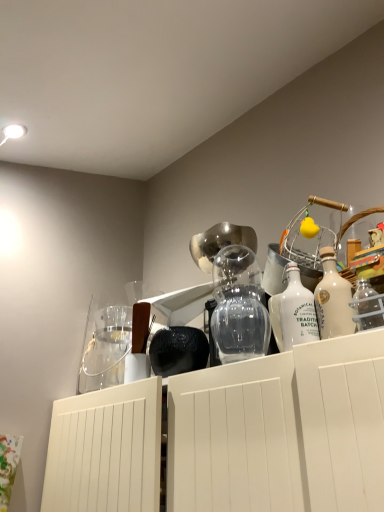
What is the approximate height of clear glass jar at upper left?

11.38 inches.

What do you see at coordinates (105, 347) in the screenshot?
I see `clear glass jar at upper left` at bounding box center [105, 347].

Image resolution: width=384 pixels, height=512 pixels. Describe the element at coordinates (293, 312) in the screenshot. I see `white glass bottle at center, arranged as the first bottle when viewed from the left` at that location.

This screenshot has height=512, width=384. Identify the location of transparent glass vase at center. (239, 306).

From a real-world perspective, relative to white glass bottle at upper right, the 1th bottle from the right, is clear glass jar at upper left vertically above or below?

In terms of real-world spatial position, clear glass jar at upper left is above white glass bottle at upper right, the 1th bottle from the right.

Is clear glass jar at upper left not within white glass bottle at upper right, the 1th bottle from the right?

Yes.

Does clear glass jar at upper left have a lesser width compared to white glass bottle at upper right, marked as the 2th bottle in a left-to-right arrangement?

No.

Where is `glass jar above the white glass bottle at center, arranged as the first bottle when viewed from the left (from a real-world perspective)`? The image size is (384, 512). glass jar above the white glass bottle at center, arranged as the first bottle when viewed from the left (from a real-world perspective) is located at coordinates (105, 347).

Is clear glass jar at upper left to the left or to the right of white glass bottle at center, arranged as the first bottle when viewed from the left, in the image?

clear glass jar at upper left is to the left of white glass bottle at center, arranged as the first bottle when viewed from the left.

Is clear glass jar at upper left in front of or behind white glass bottle at center, arranged as the first bottle when viewed from the left, in the image?

clear glass jar at upper left is behind white glass bottle at center, arranged as the first bottle when viewed from the left.

From the image's perspective, does clear glass jar at upper left appear higher than white glass bottle at center, which ranks as the 2th bottle in right-to-left order?

Actually, clear glass jar at upper left appears below white glass bottle at center, which ranks as the 2th bottle in right-to-left order, in the image.

How different are the orientations of clear glass jar at upper left and transparent glass vase at center in degrees?

0.00343 degrees.

Is clear glass jar at upper left to the right of transparent glass vase at center from the viewer's perspective?

No, clear glass jar at upper left is not to the right of transparent glass vase at center.

At what (x,y) coordinates should I click in order to perform the action: click on glass jar located behind the transparent glass vase at center. Please return your answer as a coordinate pair (x, y). Looking at the image, I should click on (105, 347).

Is clear glass jar at upper left in front of or behind transparent glass vase at center in the image?

Visually, clear glass jar at upper left is located behind transparent glass vase at center.

Based on the photo, considering the sizes of objects transparent glass vase at center and white glass bottle at center, arranged as the first bottle when viewed from the left, in the image provided, who is smaller, transparent glass vase at center or white glass bottle at center, arranged as the first bottle when viewed from the left,?

white glass bottle at center, arranged as the first bottle when viewed from the left, is smaller.

Is transparent glass vase at center looking in the opposite direction of white glass bottle at center, which ranks as the 2th bottle in right-to-left order?

No, transparent glass vase at center's orientation is not away from white glass bottle at center, which ranks as the 2th bottle in right-to-left order.

Considering the sizes of objects transparent glass vase at center and white glass bottle at center, which ranks as the 2th bottle in right-to-left order, in the image provided, who is wider, transparent glass vase at center or white glass bottle at center, which ranks as the 2th bottle in right-to-left order,?

transparent glass vase at center.

Can you tell me how much transparent glass vase at center and white glass bottle at upper right, marked as the 2th bottle in a left-to-right arrangement, differ in facing direction?

0.00211 degrees separate the facing orientations of transparent glass vase at center and white glass bottle at upper right, marked as the 2th bottle in a left-to-right arrangement.

Is transparent glass vase at center beside white glass bottle at upper right, the 1th bottle from the right?

transparent glass vase at center and white glass bottle at upper right, the 1th bottle from the right, are not in contact.

In the scene shown: Is transparent glass vase at center shorter than white glass bottle at upper right, marked as the 2th bottle in a left-to-right arrangement?

No, transparent glass vase at center is not shorter than white glass bottle at upper right, marked as the 2th bottle in a left-to-right arrangement.

Between transparent glass vase at center and white glass bottle at upper right, the 1th bottle from the right, which one is positioned in front?

white glass bottle at upper right, the 1th bottle from the right.

This screenshot has height=512, width=384. Identify the location of bottle located on the left of white glass bottle at upper right, the 1th bottle from the right. (293, 312).

Which of these two, white glass bottle at center, arranged as the first bottle when viewed from the left, or white glass bottle at upper right, the 1th bottle from the right, is bigger?

white glass bottle at upper right, the 1th bottle from the right.

Is white glass bottle at center, which ranks as the 2th bottle in right-to-left order, touching white glass bottle at upper right, marked as the 2th bottle in a left-to-right arrangement?

Yes, white glass bottle at center, which ranks as the 2th bottle in right-to-left order, is in contact with white glass bottle at upper right, marked as the 2th bottle in a left-to-right arrangement.

Is point (277, 297) less distant than point (332, 329)?

No, (277, 297) is further to viewer.

Which of these two, white glass bottle at center, arranged as the first bottle when viewed from the left, or clear glass jar at upper left, is smaller?

Smaller between the two is white glass bottle at center, arranged as the first bottle when viewed from the left.

Measure the distance from white glass bottle at center, which ranks as the 2th bottle in right-to-left order, to clear glass jar at upper left.

white glass bottle at center, which ranks as the 2th bottle in right-to-left order, and clear glass jar at upper left are 35.03 inches apart.

How different are the orientations of white glass bottle at center, arranged as the first bottle when viewed from the left, and clear glass jar at upper left in degrees?

0.0127 degrees.

Looking at this image, can you confirm if white glass bottle at center, which ranks as the 2th bottle in right-to-left order, is positioned to the right of clear glass jar at upper left?

Indeed, white glass bottle at center, which ranks as the 2th bottle in right-to-left order, is positioned on the right side of clear glass jar at upper left.

From a real-world perspective, starting from the clear glass jar at upper left, which bottle is the 1st one below it? Please provide its 2D coordinates.

[(333, 298)]

Which bottle is the 1st one when counting from the front of the clear glass jar at upper left? Please provide its 2D coordinates.

[(293, 312)]

Looking at the image, which one is located closer to transparent glass vase at center, white glass bottle at center, which ranks as the 2th bottle in right-to-left order, or white glass bottle at upper right, marked as the 2th bottle in a left-to-right arrangement?

white glass bottle at center, which ranks as the 2th bottle in right-to-left order, is closer to transparent glass vase at center.

When comparing their distances from transparent glass vase at center, does white glass bottle at upper right, the 1th bottle from the right, or clear glass jar at upper left seem closer?

white glass bottle at upper right, the 1th bottle from the right.

From the image, which object appears to be farther from transparent glass vase at center, clear glass jar at upper left or white glass bottle at center, which ranks as the 2th bottle in right-to-left order?

clear glass jar at upper left is further to transparent glass vase at center.

When comparing their distances from white glass bottle at upper right, the 1th bottle from the right, does clear glass jar at upper left or white glass bottle at center, arranged as the first bottle when viewed from the left, seem closer?

Based on the image, white glass bottle at center, arranged as the first bottle when viewed from the left, appears to be nearer to white glass bottle at upper right, the 1th bottle from the right.

Looking at this image, when comparing their distances from white glass bottle at upper right, marked as the 2th bottle in a left-to-right arrangement, does white glass bottle at center, arranged as the first bottle when viewed from the left, or clear glass jar at upper left seem further?

clear glass jar at upper left lies further to white glass bottle at upper right, marked as the 2th bottle in a left-to-right arrangement, than the other object.

Looking at the image, which one is located closer to white glass bottle at upper right, the 1th bottle from the right, white glass bottle at center, arranged as the first bottle when viewed from the left, or transparent glass vase at center?

Among the two, white glass bottle at center, arranged as the first bottle when viewed from the left, is located nearer to white glass bottle at upper right, the 1th bottle from the right.

When comparing their distances from white glass bottle at upper right, marked as the 2th bottle in a left-to-right arrangement, does transparent glass vase at center or white glass bottle at center, which ranks as the 2th bottle in right-to-left order, seem further?

transparent glass vase at center lies further to white glass bottle at upper right, marked as the 2th bottle in a left-to-right arrangement, than the other object.

Estimate the real-world distances between objects in this image. Which object is further from white glass bottle at upper right, the 1th bottle from the right, clear glass jar at upper left or transparent glass vase at center?

clear glass jar at upper left lies further to white glass bottle at upper right, the 1th bottle from the right, than the other object.

You are a GUI agent. You are given a task and a screenshot of the screen. Output one action in this format:
    pyautogui.click(x=<x>, y=<y>)
    Task: Click on the glass vase located between clear glass jar at upper left and white glass bottle at center, which ranks as the 2th bottle in right-to-left order, in the left-right direction
    
    Given the screenshot: What is the action you would take?
    pyautogui.click(x=239, y=306)

Locate an element on the screen. The image size is (384, 512). bottle between clear glass jar at upper left and white glass bottle at upper right, marked as the 2th bottle in a left-to-right arrangement, from left to right is located at coordinates (293, 312).

You are a GUI agent. You are given a task and a screenshot of the screen. Output one action in this format:
    pyautogui.click(x=<x>, y=<y>)
    Task: Click on the bottle located between transparent glass vase at center and white glass bottle at upper right, marked as the 2th bottle in a left-to-right arrangement, in the left-right direction
    This screenshot has width=384, height=512.
    Given the screenshot: What is the action you would take?
    pyautogui.click(x=293, y=312)

Locate an element on the screen. Image resolution: width=384 pixels, height=512 pixels. glass vase between clear glass jar at upper left and white glass bottle at upper right, marked as the 2th bottle in a left-to-right arrangement, in the horizontal direction is located at coordinates (239, 306).